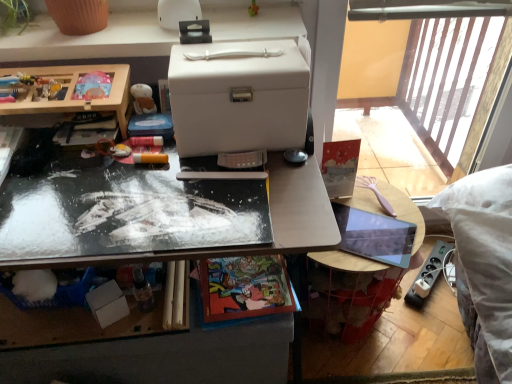
I want to click on free location above smooth wooden table at right (from a real-world perspective), so click(370, 228).